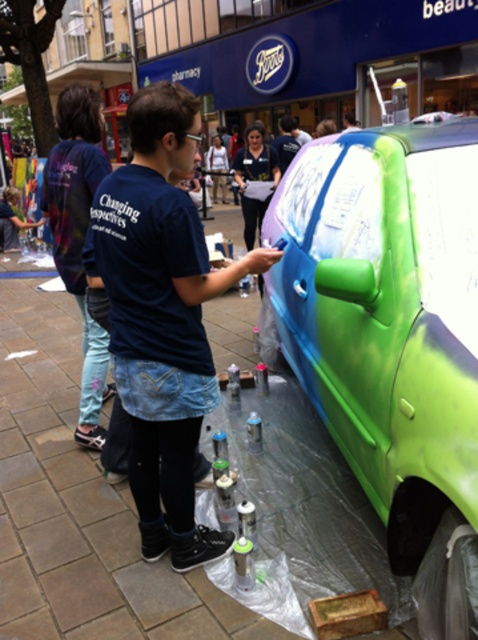
Question: Which point is closer to the camera?

Choices:
 (A) (440, 120)
 (B) (192, 390)
 (C) (282, 118)
 (D) (60, 177)

Answer: (B)

Question: Does shiny metallic car at center appear on the left side of denim jacket at left?

Choices:
 (A) yes
 (B) no

Answer: (B)

Question: Is matte blue t-shirt at center below green matte car at center?

Choices:
 (A) yes
 (B) no

Answer: (A)

Question: Which point is farther to the camera?

Choices:
 (A) (379, 278)
 (B) (423, 122)

Answer: (B)

Question: Among these points, which one is nearest to the camera?

Choices:
 (A) (76, 84)
 (B) (384, 314)
 (C) (432, 113)
 (D) (278, 156)

Answer: (B)

Question: Does matte blue t-shirt at center come in front of denim jacket at left?

Choices:
 (A) no
 (B) yes

Answer: (B)